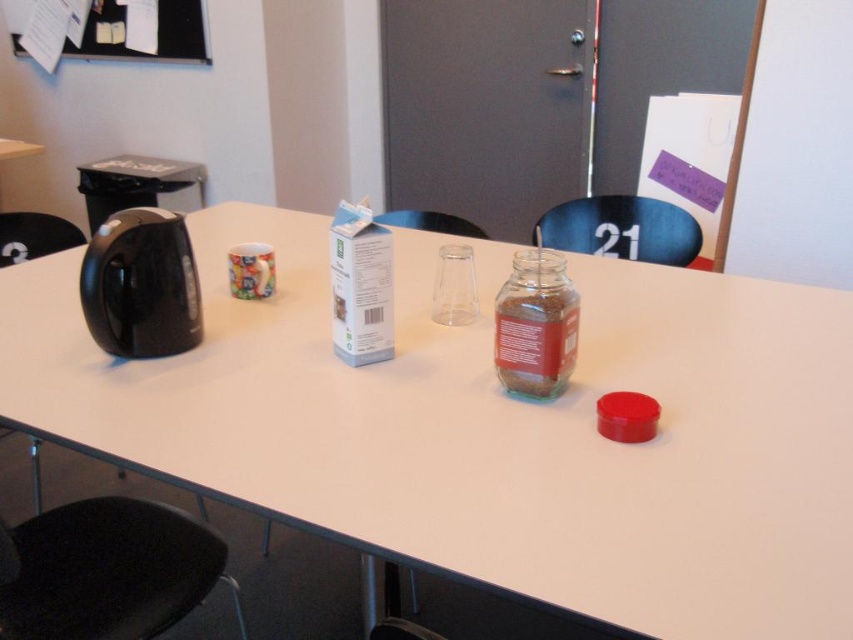
Is point (137, 589) closer to camera compared to point (125, 29)?

Yes, it is.

Can you confirm if black plastic chair at lower left is shorter than black feltboard at upper left?

Yes, black plastic chair at lower left is shorter than black feltboard at upper left.

Is point (167, 531) closer to camera compared to point (141, 60)?

Yes, it is.

Find the location of `black plastic chair at lower left`. black plastic chair at lower left is located at coordinates click(105, 570).

Can you confirm if white glossy table at center is bigger than transparent glass jar at center?

Yes.

Is point (752, 394) closer to camera compared to point (544, 381)?

No, it is not.

What are the coordinates of `white glossy table at center` in the screenshot? It's located at pos(491,428).

Where is `white glossy table at center`? The height and width of the screenshot is (640, 853). white glossy table at center is located at coordinates (491, 428).

Is point (585, 220) positioned behind point (398, 211)?

That is False.

Looking at this image, who is positioned more to the right, black plastic chair at center or transparent plastic cup at center?

Positioned to the right is black plastic chair at center.

You are a GUI agent. You are given a task and a screenshot of the screen. Output one action in this format:
    pyautogui.click(x=<x>, y=<y>)
    Task: Click on the black plastic chair at center
    
    Given the screenshot: What is the action you would take?
    pyautogui.click(x=622, y=228)